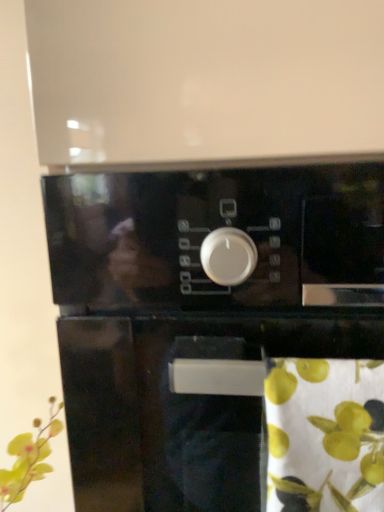
Locate an element on the screen. green fabric at lower right is located at coordinates (325, 435).

What do you see at coordinates (325, 435) in the screenshot?
I see `green fabric at lower right` at bounding box center [325, 435].

Measure the distance between black glossy oven at center and camera.

black glossy oven at center is 9.85 inches away from camera.

Identify the location of black glossy oven at center. (222, 334).

This screenshot has height=512, width=384. What do you see at coordinates (222, 334) in the screenshot? I see `black glossy oven at center` at bounding box center [222, 334].

Find the location of `green fabric at lower right`. green fabric at lower right is located at coordinates (325, 435).

Is black glossy oven at center at the right side of green fabric at lower right?

No.

Looking at this image, considering the relative positions of black glossy oven at center and green fabric at lower right in the image provided, is black glossy oven at center behind green fabric at lower right?

Yes, the depth of black glossy oven at center is greater than that of green fabric at lower right.

Is point (381, 420) positioned behind point (302, 461)?

No, it is in front of (302, 461).

From the image's perspective, who appears lower, black glossy oven at center or green fabric at lower right?

From the image's view, green fabric at lower right is below.

From a real-world perspective, between black glossy oven at center and green fabric at lower right, who is vertically higher?

In real-world perspective, green fabric at lower right is above.

Can you confirm if black glossy oven at center is wider than green fabric at lower right?

Yes.

Between black glossy oven at center and green fabric at lower right, which one has less height?

Standing shorter between the two is green fabric at lower right.

Considering the sizes of objects black glossy oven at center and green fabric at lower right in the image provided, who is bigger, black glossy oven at center or green fabric at lower right?

black glossy oven at center is bigger.

Is black glossy oven at center inside or outside of green fabric at lower right?

black glossy oven at center is not enclosed by green fabric at lower right.

Is black glossy oven at center directly adjacent to green fabric at lower right?

black glossy oven at center is not next to green fabric at lower right, and they're not touching.

Is black glossy oven at center oriented towards green fabric at lower right?

Yes, black glossy oven at center is facing green fabric at lower right.

Find the location of a particular element. This screenshot has width=384, height=512. flower that appears below the black glossy oven at center (from the image's perspective) is located at coordinates (325, 435).

Considering the relative positions of green fabric at lower right and black glossy oven at center in the image provided, is green fabric at lower right to the left or to the right of black glossy oven at center?

green fabric at lower right is to the right of black glossy oven at center.

Between green fabric at lower right and black glossy oven at center, which one is positioned in front?

green fabric at lower right.

Does point (280, 428) lie in front of point (187, 210)?

That is True.

From the image's perspective, would you say green fabric at lower right is shown under black glossy oven at center?

Yes, from the image's perspective, green fabric at lower right is beneath black glossy oven at center.

From a real-world perspective, which is physically below, green fabric at lower right or black glossy oven at center?

black glossy oven at center, from a real-world perspective.

Between green fabric at lower right and black glossy oven at center, which one has larger width?

black glossy oven at center is wider.

Is green fabric at lower right taller than black glossy oven at center?

No.

Which of these two, green fabric at lower right or black glossy oven at center, is bigger?

black glossy oven at center.

Is green fabric at lower right positioned beyond the bounds of black glossy oven at center?

No, green fabric at lower right is inside or overlapping with black glossy oven at center.

Is the surface of green fabric at lower right in direct contact with black glossy oven at center?

No, green fabric at lower right is not making contact with black glossy oven at center.

Could you tell me if green fabric at lower right is turned towards black glossy oven at center?

Yes, green fabric at lower right is aimed at black glossy oven at center.

What's the angular difference between green fabric at lower right and black glossy oven at center's facing directions?

The facing directions of green fabric at lower right and black glossy oven at center are 0.00103 degrees apart.

Measure the distance between green fabric at lower right and black glossy oven at center.

A distance of 17.47 inches exists between green fabric at lower right and black glossy oven at center.

You are a GUI agent. You are given a task and a screenshot of the screen. Output one action in this format:
    pyautogui.click(x=<x>, y=<y>)
    Task: Click on the flower in front of the black glossy oven at center
    
    Given the screenshot: What is the action you would take?
    pyautogui.click(x=325, y=435)

Locate an element on the screen. flower in front of the black glossy oven at center is located at coordinates (325, 435).

In order to click on home appliance behind the green fabric at lower right in this screenshot , I will do `click(222, 334)`.